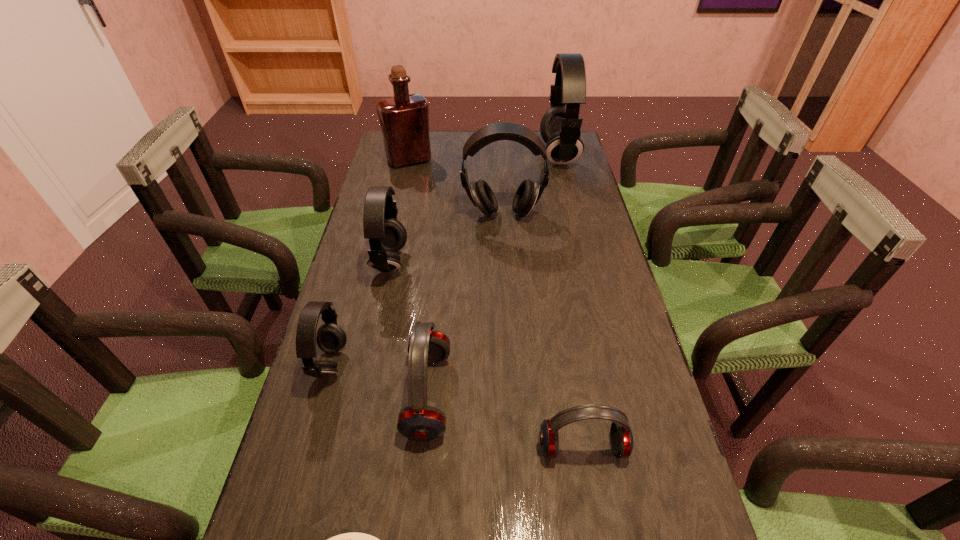
Locate an element on the screen. The height and width of the screenshot is (540, 960). the leftmost black earphone is located at coordinates (331, 338).

Find the location of a particular element. This screenshot has width=960, height=540. the right red earphone is located at coordinates (621, 436).

The height and width of the screenshot is (540, 960). Find the location of `the shortest earphone`. the shortest earphone is located at coordinates (621, 436).

The height and width of the screenshot is (540, 960). Find the location of `blank space located on the ear cups of the biggest black earphone`. blank space located on the ear cups of the biggest black earphone is located at coordinates (491, 155).

Locate an element on the screen. blank area located on the ear cups of the biggest black earphone is located at coordinates (504, 155).

Where is `blank space located 0.260m on the ear cups of the biggest black earphone`? Image resolution: width=960 pixels, height=540 pixels. blank space located 0.260m on the ear cups of the biggest black earphone is located at coordinates (472, 155).

The width and height of the screenshot is (960, 540). Find the location of `blank space located on the front of the liquor`. blank space located on the front of the liquor is located at coordinates (397, 214).

Where is `blank area located 0.400m on the ear cups of the third farthest object`? The image size is (960, 540). blank area located 0.400m on the ear cups of the third farthest object is located at coordinates (509, 325).

The width and height of the screenshot is (960, 540). I want to click on free space located 0.150m on the ear cups of the fifth earphone from right to left, so click(459, 263).

At what (x,y) coordinates should I click in order to perform the action: click on vacant space located 0.300m on the ear cups of the left red earphone. Please return your answer as a coordinate pair (x, y). This screenshot has width=960, height=540. Looking at the image, I should click on (587, 395).